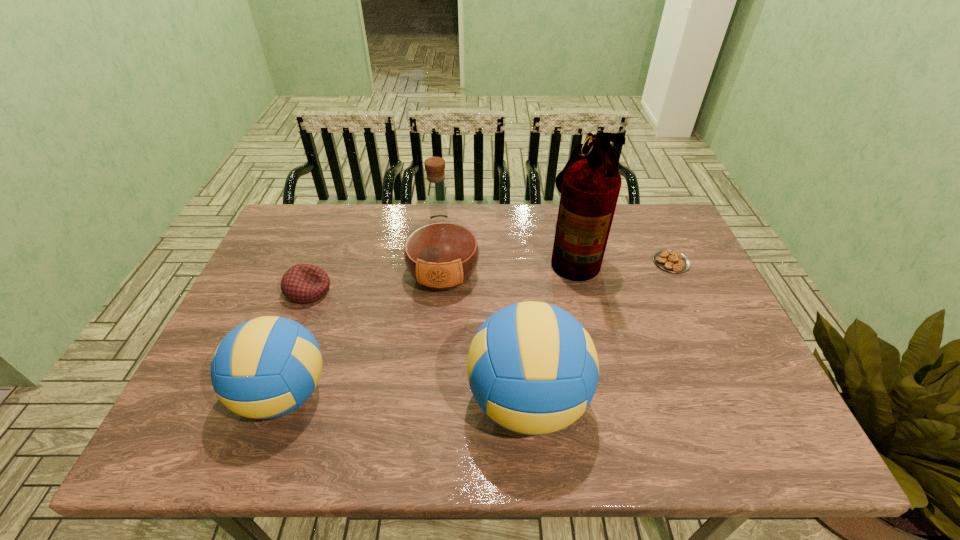
Find the location of `vacant area between the second shortest object and the rightmost object`. vacant area between the second shortest object and the rightmost object is located at coordinates (490, 276).

The image size is (960, 540). Find the location of `vacant area that lies between the tallest object and the fifth shortest object`. vacant area that lies between the tallest object and the fifth shortest object is located at coordinates point(508,264).

Image resolution: width=960 pixels, height=540 pixels. Find the location of `free space between the fourth tallest object and the shortest object`. free space between the fourth tallest object and the shortest object is located at coordinates (477, 328).

This screenshot has width=960, height=540. In order to click on empty space that is in between the pastry and the fire extinguisher in this screenshot , I will do `click(622, 258)`.

What are the coordinates of `vacant area that lies between the beanbag and the rightmost object` in the screenshot? It's located at (490, 276).

Where is `free space between the fourth shortest object and the left volleyball`? free space between the fourth shortest object and the left volleyball is located at coordinates (406, 397).

At what (x,y) coordinates should I click in order to perform the action: click on empty location between the pastry and the fire extinguisher. Please return your answer as a coordinate pair (x, y). Image resolution: width=960 pixels, height=540 pixels. Looking at the image, I should click on (622, 258).

Identify which object is the second nearest to the tallest object. Please provide its 2D coordinates. Your answer should be formatted as a tuple, i.e. [(x, y)], where the tuple contains the x and y coordinates of a point satisfying the conditions above.

[(533, 369)]

At what (x,y) coordinates should I click in order to perform the action: click on object that is the fifth closest to the left volleyball. Please return your answer as a coordinate pair (x, y). This screenshot has height=540, width=960. Looking at the image, I should click on (669, 260).

This screenshot has width=960, height=540. Find the location of `free space that satisfies the following two spatial constraints: 1. at the nozzle of the fire extinguisher; 2. on the back side of the shortest object`. free space that satisfies the following two spatial constraints: 1. at the nozzle of the fire extinguisher; 2. on the back side of the shortest object is located at coordinates (575, 262).